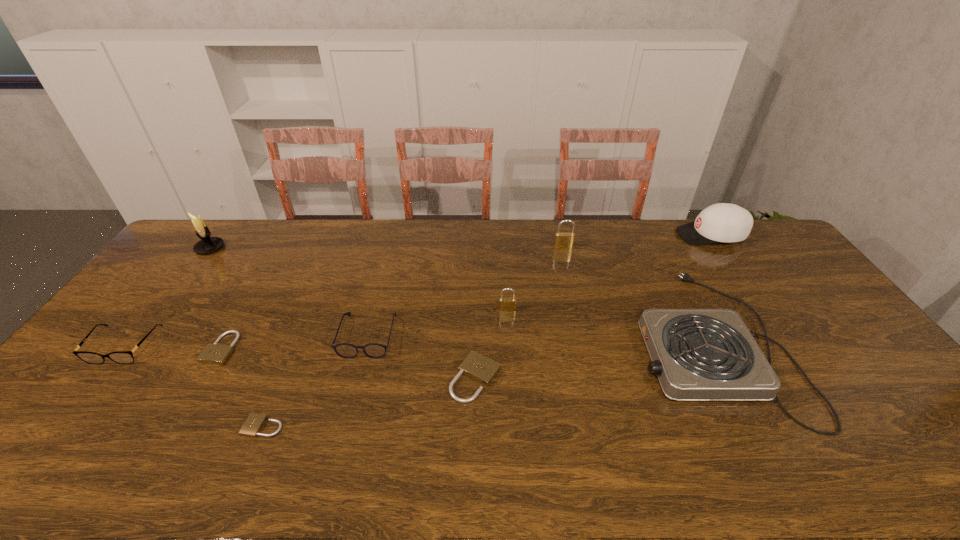
Where is `free location located 0.100m on the front-facing side of the third object from right to left`? This screenshot has height=540, width=960. free location located 0.100m on the front-facing side of the third object from right to left is located at coordinates (568, 267).

Image resolution: width=960 pixels, height=540 pixels. I want to click on vacant region located on the front-facing side of the left brass padlock, so click(x=514, y=411).

The image size is (960, 540). I want to click on vacant region located with a retractable cable on the side of the hotplate, so click(x=592, y=343).

The width and height of the screenshot is (960, 540). Identify the location of vacant space situated with a retractable cable on the side of the hotplate. (527, 343).

Identify the location of vacant space located with a retractable cable on the side of the hotplate. This screenshot has width=960, height=540. (544, 343).

You are a GUI agent. You are given a task and a screenshot of the screen. Output one action in this format:
    pyautogui.click(x=<x>, y=<y>)
    Task: Click on the free spot located on the front-facing side of the fifth object from left to right
    
    Given the screenshot: What is the action you would take?
    pyautogui.click(x=346, y=423)

The height and width of the screenshot is (540, 960). Identify the location of vacant point located 0.180m on the front-facing side of the left spectacles. (65, 423).

Find the location of a particular element. vacant position located 0.070m on the back of the sixth object from left to right is located at coordinates (476, 336).

Locate an element on the screen. blank space located on the right of the leftmost padlock is located at coordinates (351, 348).

You are a GUI agent. You are given a task and a screenshot of the screen. Output one action in this format:
    pyautogui.click(x=<x>, y=<y>)
    Task: Click on the vacant region located on the front of the nearest padlock
    The height and width of the screenshot is (540, 960).
    Given the screenshot: What is the action you would take?
    pyautogui.click(x=246, y=471)